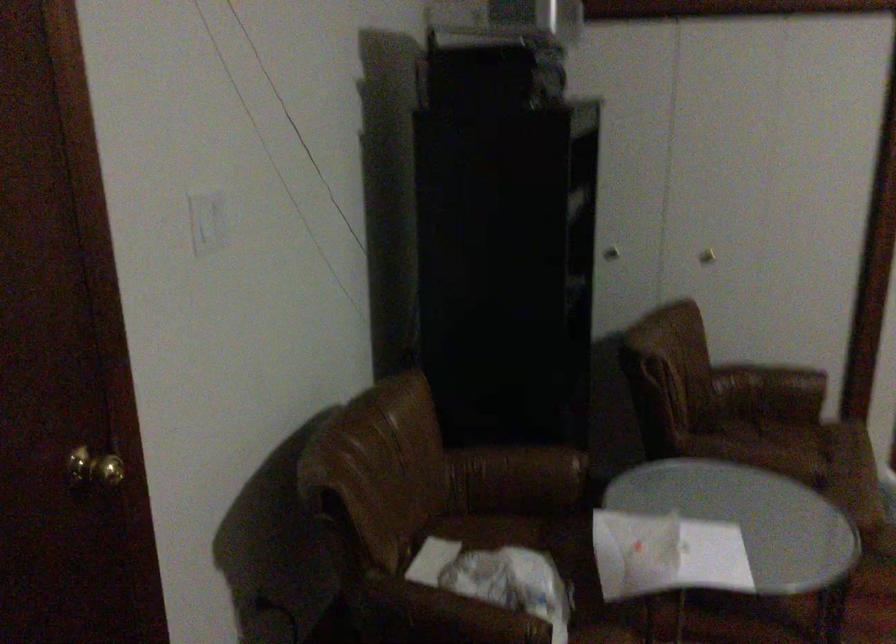
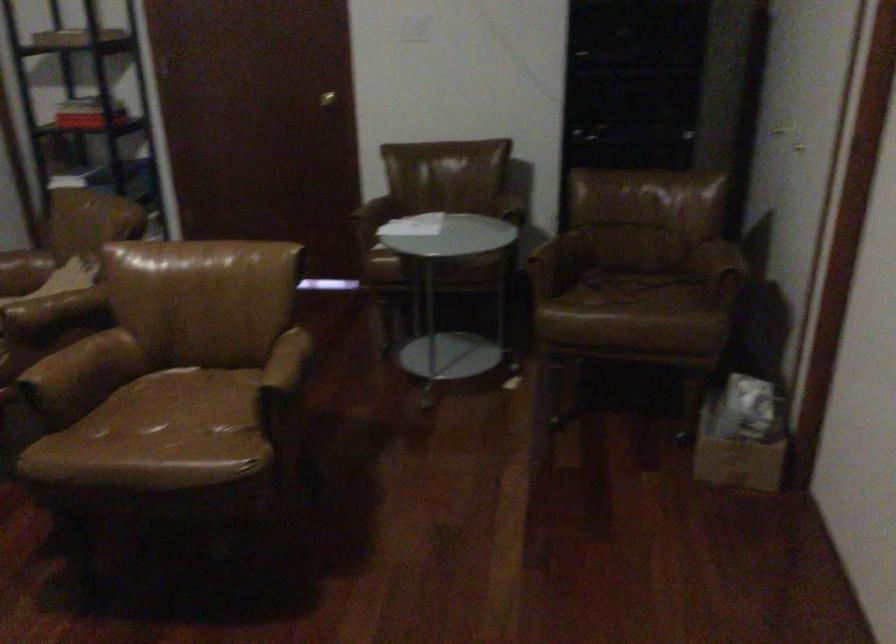
Locate, in the second image, the point that corresponds to the point at 773,448 in the first image.

(627, 288)